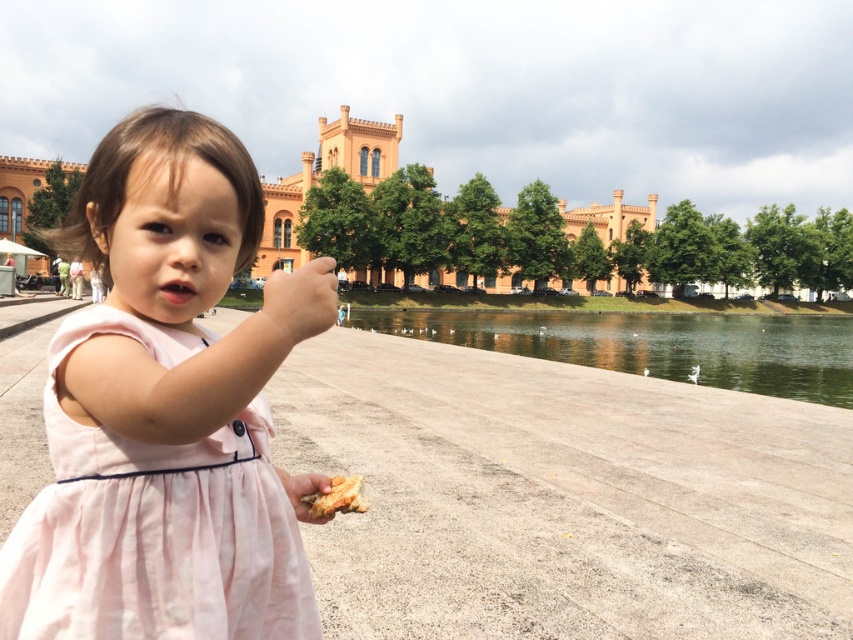
You are a photographer trying to capture the pink cotton dress at center and the golden crispy bread at lower center in the same frame. Based on their positions, which object should you focus on first to ensure both are in focus?

The pink cotton dress at center is in front of the golden crispy bread at lower center, so you should focus on the pink cotton dress at center first to ensure both are in focus.

You are a parent watching your child at the park. You see the transparent water at lower center and the golden crispy bread at lower center. Which item is closer to the child?

The transparent water at lower center is located above the golden crispy bread at lower center, so the golden crispy bread at lower center is closer to the child.

You are standing at the camera position and see the point marked as point (271, 634). You want to walk straight towards it. How far will you have to walk to reach it?

You will have to walk 69.26 feet to reach the point (271, 634) because it is 69.26 feet away from the camera.